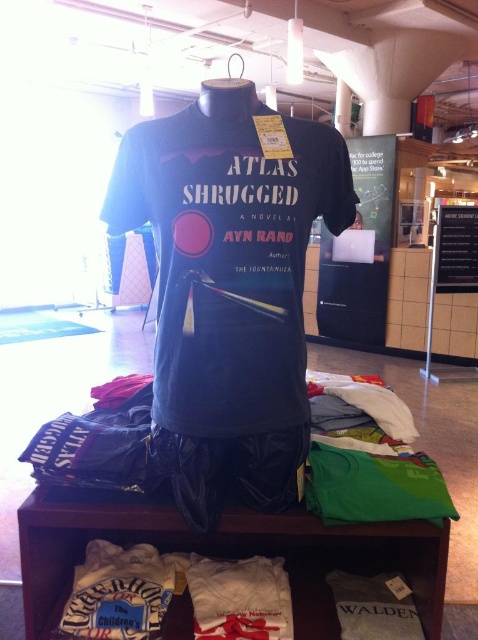
Is point (238, 326) positioned before point (243, 520)?

Yes.

The height and width of the screenshot is (640, 478). In order to click on dark blue cotton t-shirt at center in this screenshot , I will do `click(228, 260)`.